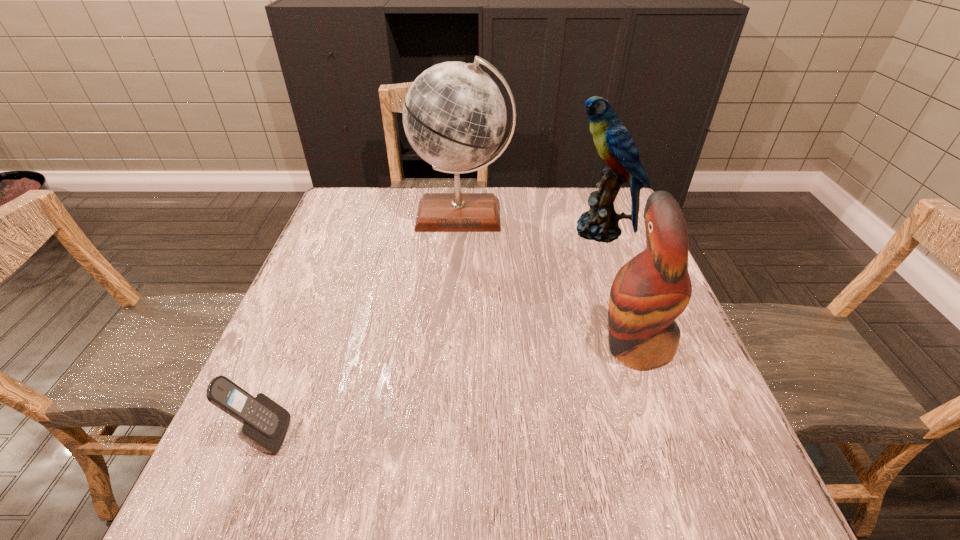
Find the location of a particular element. The height and width of the screenshot is (540, 960). the tallest object is located at coordinates (454, 115).

The width and height of the screenshot is (960, 540). What are the coordinates of `the second object from left to right` in the screenshot? It's located at (454, 115).

The width and height of the screenshot is (960, 540). What are the coordinates of `the farther parrot` in the screenshot? It's located at (614, 144).

Find the location of a particular element. the second nearest object is located at coordinates (650, 291).

This screenshot has width=960, height=540. Find the location of `the shortest object`. the shortest object is located at coordinates (265, 423).

At what (x,y) coordinates should I click in order to perform the action: click on the nearest object. Please return your answer as a coordinate pair (x, y). Image resolution: width=960 pixels, height=540 pixels. Looking at the image, I should click on (265, 423).

The image size is (960, 540). In order to click on vacant space located 0.230m at the equator of the second object from left to right in this screenshot , I will do `click(458, 301)`.

The width and height of the screenshot is (960, 540). I want to click on vacant area located 0.200m on the face of the farther parrot, so click(x=495, y=231).

Where is `vacant space located 0.400m on the face of the farther parrot`? vacant space located 0.400m on the face of the farther parrot is located at coordinates (423, 231).

This screenshot has height=540, width=960. In order to click on vacant area situated 0.290m on the face of the farther parrot in this screenshot , I will do `click(463, 231)`.